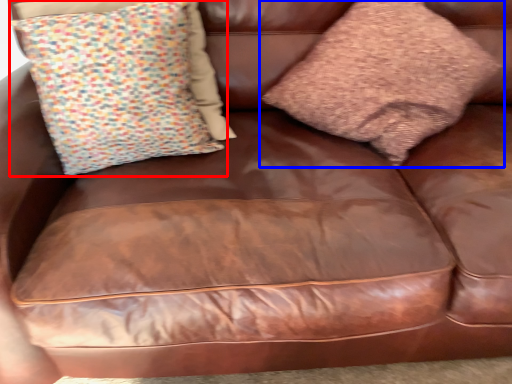
Question: Which point is further to the camera, pillow (highlighted by a red box) or pillow (highlighted by a blue box)?

Choices:
 (A) pillow
 (B) pillow

Answer: (A)